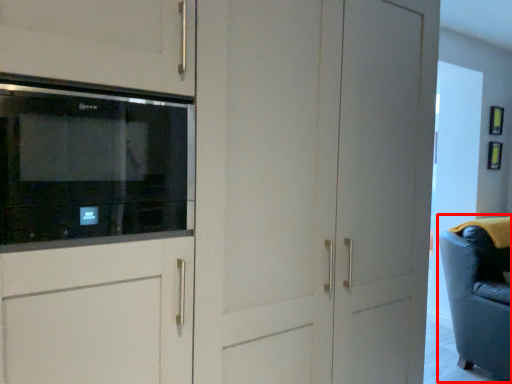
Question: From the image, what is the correct spatial relationship of swivel chair (annotated by the red box) in relation to microwave oven?

Choices:
 (A) left
 (B) right

Answer: (B)